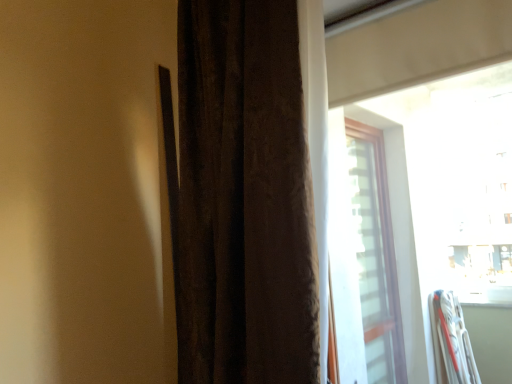
Question: Is brown textured curtain at center shorter than transparent glass window at upper right?

Choices:
 (A) no
 (B) yes

Answer: (A)

Question: Does brown textured curtain at center appear on the right side of transparent glass window at upper right?

Choices:
 (A) no
 (B) yes

Answer: (A)

Question: Is brown textured curtain at center facing towards transparent glass window at upper right?

Choices:
 (A) no
 (B) yes

Answer: (A)

Question: Is brown textured curtain at center located outside transparent glass window at upper right?

Choices:
 (A) no
 (B) yes

Answer: (B)

Question: Can you confirm if brown textured curtain at center is smaller than transparent glass window at upper right?

Choices:
 (A) no
 (B) yes

Answer: (A)

Question: Is brown textured curtain at center looking in the opposite direction of transparent glass window at upper right?

Choices:
 (A) yes
 (B) no

Answer: (B)

Question: Does transparent glass window at upper right contain brown textured curtain at center?

Choices:
 (A) no
 (B) yes

Answer: (A)

Question: Does transparent glass window at upper right have a greater width compared to brown textured curtain at center?

Choices:
 (A) no
 (B) yes

Answer: (A)

Question: Can you confirm if transparent glass window at upper right is taller than brown textured curtain at center?

Choices:
 (A) yes
 (B) no

Answer: (B)

Question: Is transparent glass window at upper right aimed at brown textured curtain at center?

Choices:
 (A) yes
 (B) no

Answer: (B)

Question: From a real-world perspective, is transparent glass window at upper right positioned under brown textured curtain at center based on gravity?

Choices:
 (A) yes
 (B) no

Answer: (A)

Question: Considering the relative positions of transparent glass window at upper right and brown textured curtain at center in the image provided, is transparent glass window at upper right to the right of brown textured curtain at center from the viewer's perspective?

Choices:
 (A) yes
 (B) no

Answer: (A)

Question: Is brown textured curtain at center to the left or to the right of transparent glass window at upper right in the image?

Choices:
 (A) left
 (B) right

Answer: (A)